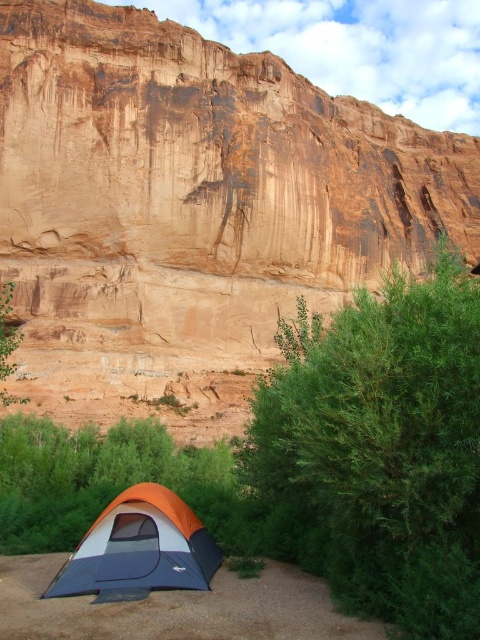
From the picture: Is green leafy bush at lower right positioned before orange fabric tent at lower left?

Yes.

Which is in front, point (337, 589) or point (123, 566)?

Point (337, 589) is in front.

Locate an element on the screen. green leafy bush at lower right is located at coordinates (379, 451).

Which of these two, green leafy bush at lower right or green leafy tree at lower left, stands shorter?

green leafy tree at lower left

Can you confirm if green leafy bush at lower right is wider than green leafy tree at lower left?

Yes.

Locate an element on the screen. The image size is (480, 640). green leafy bush at lower right is located at coordinates (379, 451).

Does orange fabric tent at lower left have a greater width compared to green leafy tree at lower left?

Correct, the width of orange fabric tent at lower left exceeds that of green leafy tree at lower left.

Describe the element at coordinates (140, 547) in the screenshot. I see `orange fabric tent at lower left` at that location.

The image size is (480, 640). I want to click on orange fabric tent at lower left, so click(x=140, y=547).